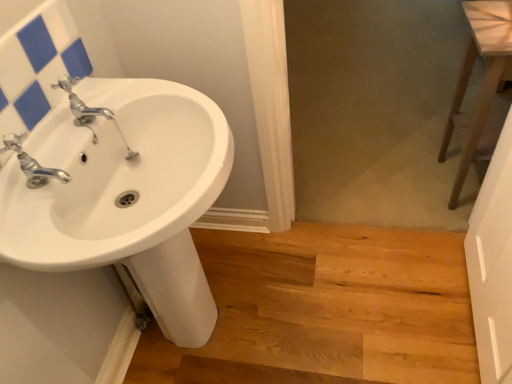
I want to click on vacant area on the back side of silver metallic faucet at left, so click(64, 148).